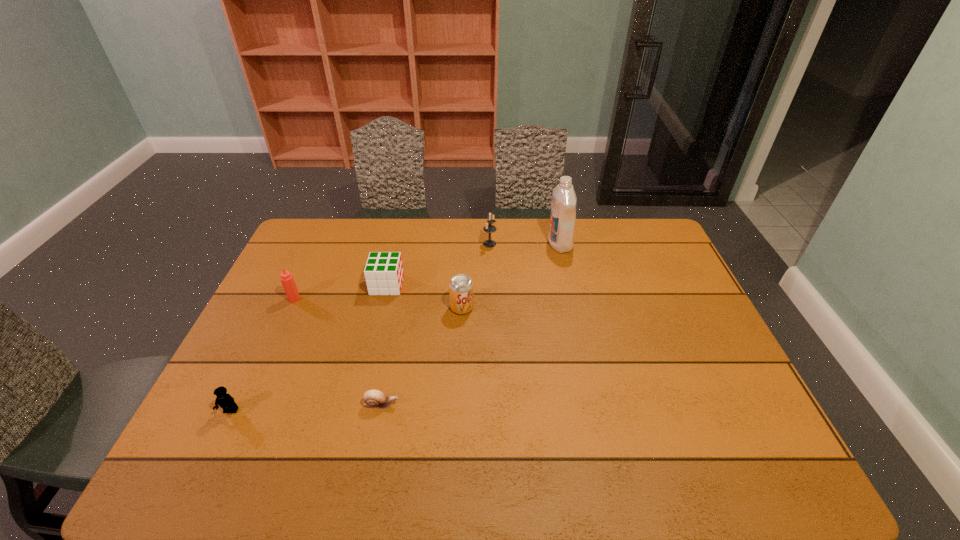
At what (x,y) coordinates should I click in order to perform the action: click on vacant space that's between the third object from right to left and the escargot. Please return your answer as a coordinate pair (x, y). The height and width of the screenshot is (540, 960). Looking at the image, I should click on (421, 356).

Where is `free spot between the second object from right to left and the escargot`? The width and height of the screenshot is (960, 540). free spot between the second object from right to left and the escargot is located at coordinates (436, 324).

Identify the location of empty location between the shortest object and the detergent. (470, 324).

Point out which object is positioned as the fourth nearest to the Tabasco sauce. Please provide its 2D coordinates. Your answer should be formatted as a tuple, i.e. [(x, y)], where the tuple contains the x and y coordinates of a point satisfying the conditions above.

[(460, 286)]

Identify which object is located as the third nearest to the Tabasco sauce. Please provide its 2D coordinates. Your answer should be formatted as a tuple, i.e. [(x, y)], where the tuple contains the x and y coordinates of a point satisfying the conditions above.

[(373, 398)]

Identify the location of free point that satisfies the following two spatial constraints: 1. on the red face of the cube; 2. on the left side of the fifth object from left to right. (381, 307).